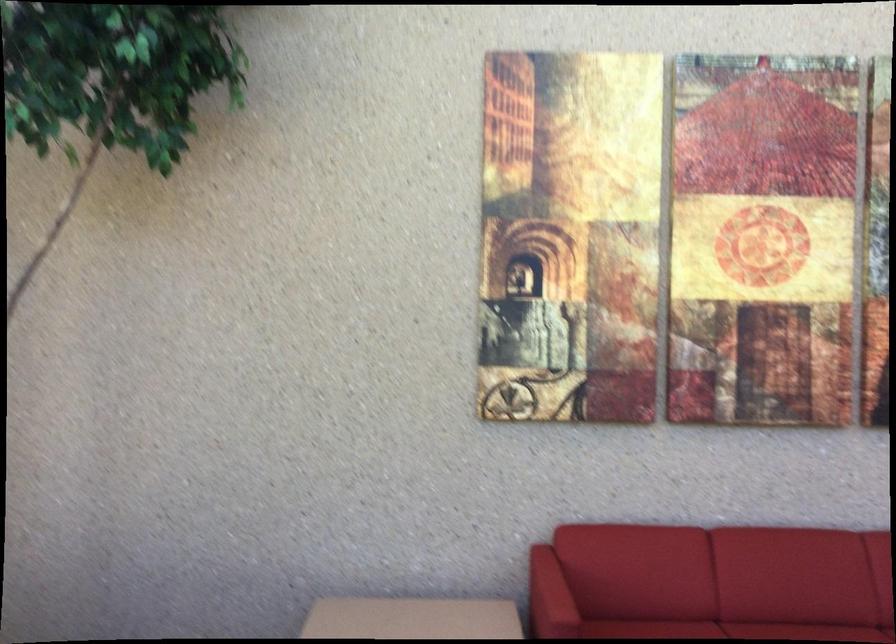
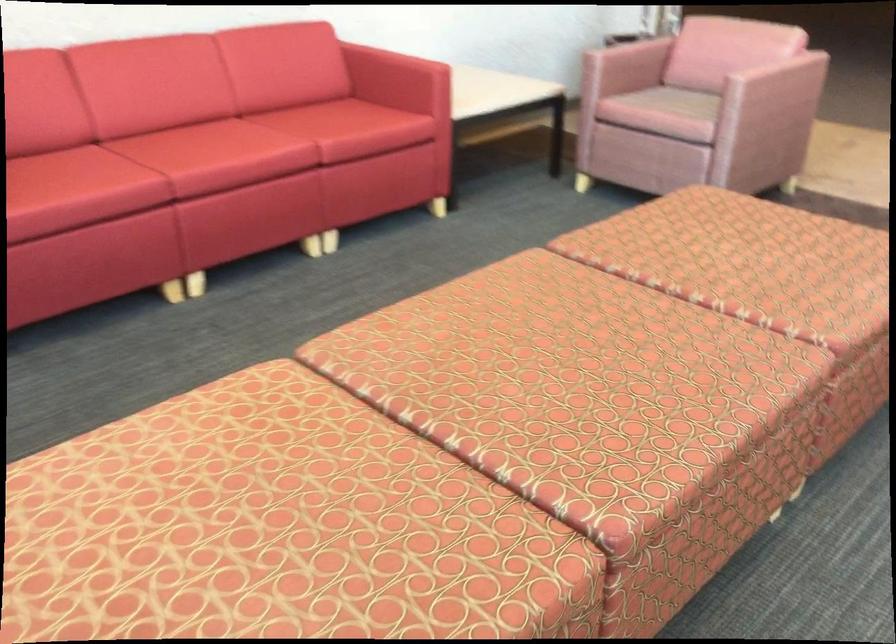
Looking at this image, how did the camera likely rotate?

The camera's rotation is toward right-down.